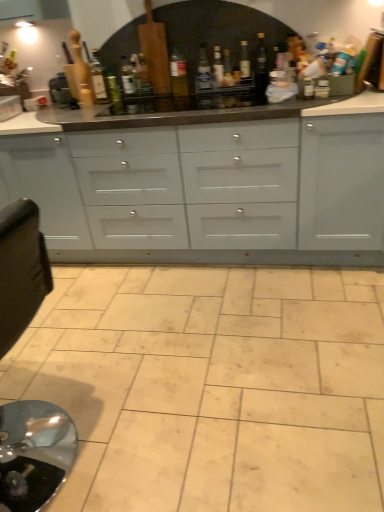
Question: From the image's perspective, is wooden rolling pin at upper left, which is counted as the 1th bottle, starting from the left, located above or below white glossy cabinets at center?

Choices:
 (A) above
 (B) below

Answer: (A)

Question: Considering the positions of wooden rolling pin at upper left, which is counted as the 1th bottle, starting from the left, and white glossy cabinets at center in the image, is wooden rolling pin at upper left, which is counted as the 1th bottle, starting from the left, taller or shorter than white glossy cabinets at center?

Choices:
 (A) short
 (B) tall

Answer: (A)

Question: Considering the real-world distances, which object is closest to the transparent glass bottle at center, which is the second bottle in right-to-left order?

Choices:
 (A) white glossy cabinets at center
 (B) translucent glass bottle at center, the eighth bottle in the right-to-left sequence
 (C) translucent amber glass bottle at upper center, the 9th bottle from the right
 (D) wooden rolling pin at upper left, which is counted as the 1th bottle, starting from the left
 (E) translucent glass bottle at center, acting as the fifth bottle starting from the right

Answer: (E)

Question: Considering the real-world distances, which object is closest to the translucent glass bottle at upper center, the 4th bottle viewed from the left?

Choices:
 (A) transparent glass bottle at center, the 9th bottle in the left-to-right sequence
 (B) translucent glass bottle at center, which is the 3th bottle in left-to-right order
 (C) wooden rolling pin at upper left, which is counted as the 1th bottle, starting from the left
 (D) translucent glass bottle at center, which ranks as the 8th bottle in left-to-right order
 (E) translucent glass bottle at center, the 6th bottle positioned from the left

Answer: (B)